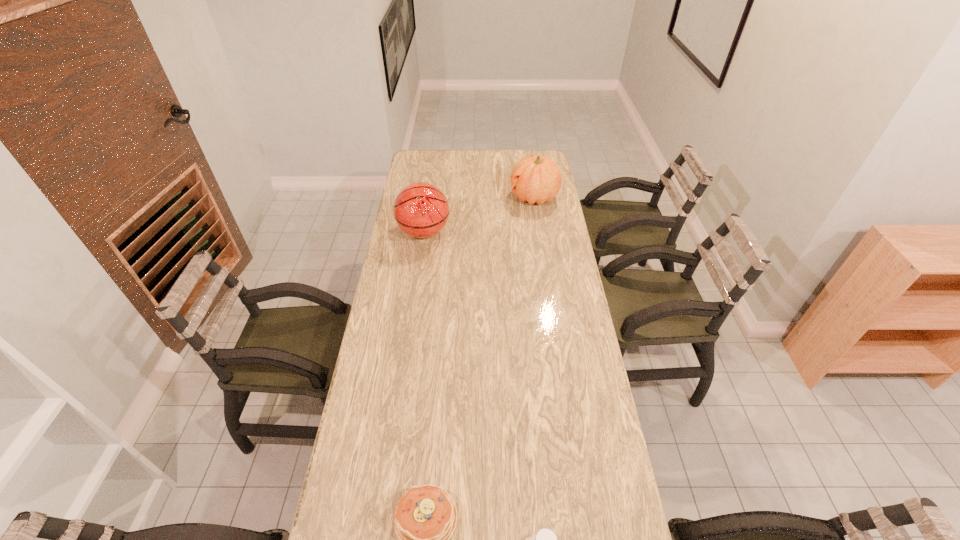
Locate an element on the screen. This screenshot has width=960, height=540. pumpkin is located at coordinates (537, 179).

What are the coordinates of `basketball` in the screenshot? It's located at (421, 210).

Where is `blank area located on the carved face of the pumpkin`? This screenshot has height=540, width=960. blank area located on the carved face of the pumpkin is located at coordinates (439, 198).

Find the location of a particular element. Image resolution: width=960 pixels, height=540 pixels. blank space located 0.300m on the carved face of the pumpkin is located at coordinates (448, 198).

I want to click on vacant space located on the carved face of the pumpkin, so click(469, 198).

Where is `free space located 0.210m on the side with spill of the basketball`? free space located 0.210m on the side with spill of the basketball is located at coordinates (497, 232).

Where is `object that is at the left edge`? object that is at the left edge is located at coordinates (421, 210).

I want to click on object located at the right edge, so click(537, 179).

Where is `vacant area at the far edge`? This screenshot has width=960, height=540. vacant area at the far edge is located at coordinates (445, 157).

Where is `vacant space at the left edge of the desktop`? The width and height of the screenshot is (960, 540). vacant space at the left edge of the desktop is located at coordinates tap(373, 412).